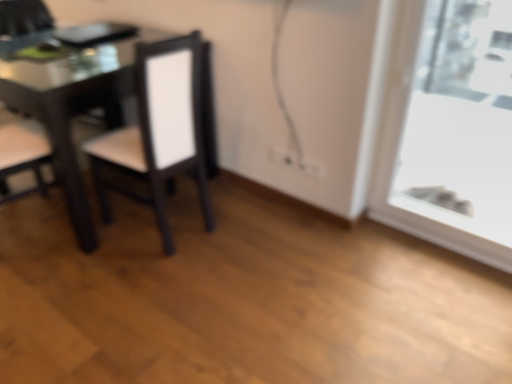
Find the location of `vacant region in front of matte black chair at center, which ranks as the 2th chair in left-to-right order`. vacant region in front of matte black chair at center, which ranks as the 2th chair in left-to-right order is located at coordinates (149, 278).